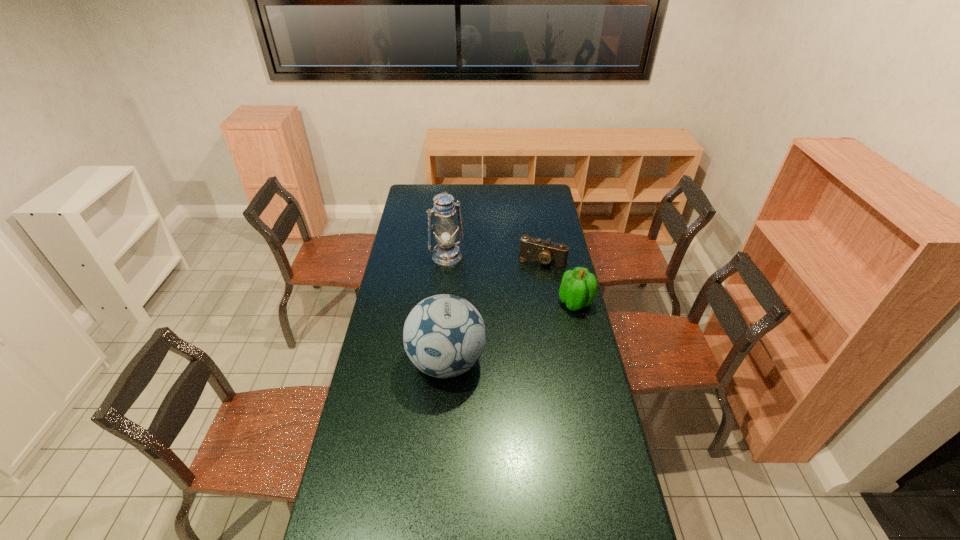
This screenshot has width=960, height=540. What are the coordinates of `blank space at the far left corner of the desktop` in the screenshot? It's located at (422, 190).

Where is `vacant region at the near left corner of the desktop`? The width and height of the screenshot is (960, 540). vacant region at the near left corner of the desktop is located at coordinates (330, 538).

Where is `free spot between the camera and the lantern`? This screenshot has height=540, width=960. free spot between the camera and the lantern is located at coordinates (494, 259).

Locate an element on the screen. Image resolution: width=960 pixels, height=540 pixels. empty space between the camera and the second shortest object is located at coordinates (559, 281).

The width and height of the screenshot is (960, 540). In order to click on free point between the lantern and the shortest object in this screenshot , I will do `click(494, 259)`.

In order to click on blank region between the tallest object and the shortest object in this screenshot , I will do `click(494, 259)`.

Find the location of `empty space between the soccer ball and the camera`. empty space between the soccer ball and the camera is located at coordinates 494,311.

Find the location of `vacant space that's between the shortest object and the soccer ball`. vacant space that's between the shortest object and the soccer ball is located at coordinates (494, 311).

Locate an element on the screen. blank region between the camera and the nearest object is located at coordinates (494, 311).

Locate which object is the closest to the second shortest object. Please provide its 2D coordinates. Your answer should be formatted as a tuple, i.e. [(x, y)], where the tuple contains the x and y coordinates of a point satisfying the conditions above.

[(547, 252)]